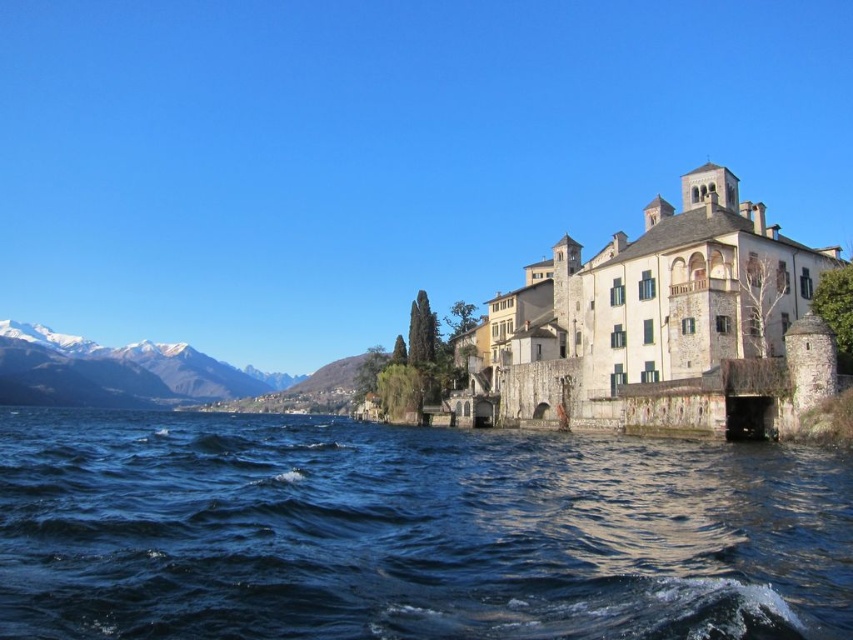
You are a photographer planning to capture the dark blue water at lower left and the snowy white mountain at left in a single frame. Based on their positions and sizes, which object will appear larger in the photo?

The dark blue water at lower left will appear larger in the photo because it is not as tall as the snowy white mountain at left, but its position at the lower left might make it occupy more space in the frame.